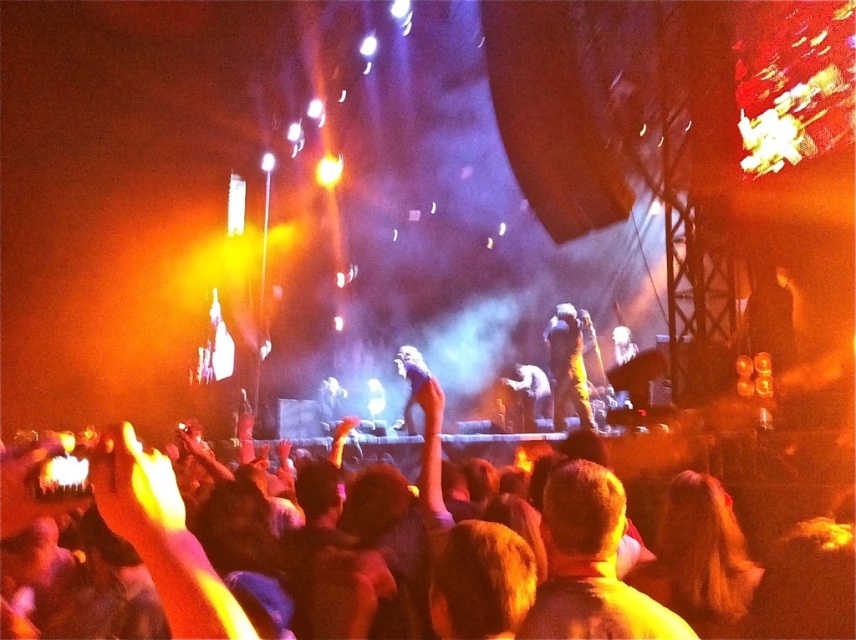
Question: Which of the following is the farthest from the observer?

Choices:
 (A) (524, 403)
 (B) (581, 394)

Answer: (A)

Question: Is matte gold jacket at center smaller than shiny silver microphone at center?

Choices:
 (A) yes
 (B) no

Answer: (B)

Question: Where is matte gold jacket at center located in relation to shiny silver microphone at center in the image?

Choices:
 (A) above
 (B) below

Answer: (A)

Question: Does matte gold jacket at center have a lesser width compared to shiny silver microphone at center?

Choices:
 (A) no
 (B) yes

Answer: (B)

Question: Which of the following is the farthest from the observer?

Choices:
 (A) (526, 378)
 (B) (583, 410)

Answer: (A)